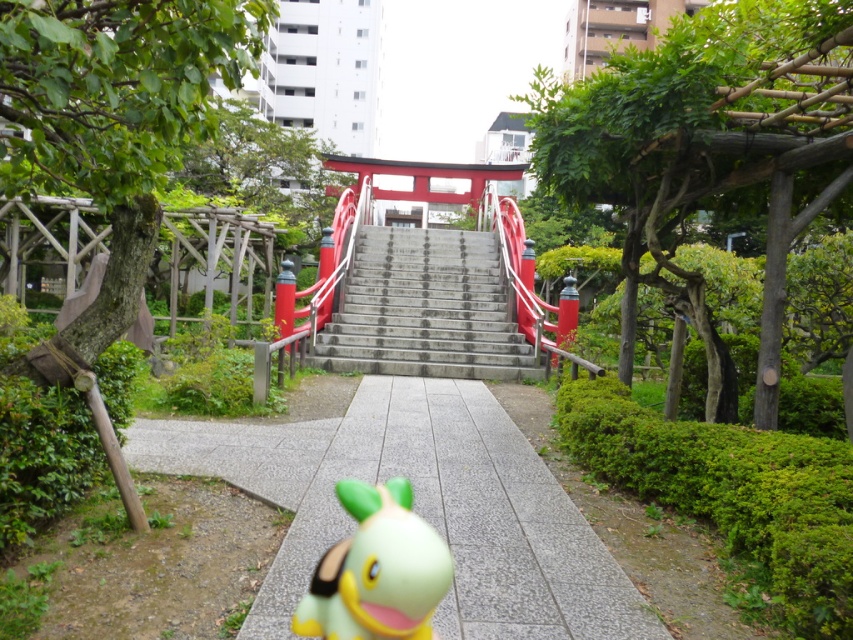
Does smooth concrete path at center have a smaller size compared to smooth concrete stairs at center?

Yes, smooth concrete path at center is smaller than smooth concrete stairs at center.

Can you confirm if smooth concrete path at center is taller than smooth concrete stairs at center?

No, smooth concrete path at center is not taller than smooth concrete stairs at center.

Who is more distant from viewer, (624, 614) or (376, 371)?

Point (376, 371)

Locate an element on the screen. This screenshot has width=853, height=640. smooth concrete path at center is located at coordinates (418, 506).

What do you see at coordinates (418, 506) in the screenshot?
I see `smooth concrete path at center` at bounding box center [418, 506].

Can you confirm if smooth concrete path at center is wider than green rubber toy at center?

Yes, smooth concrete path at center is wider than green rubber toy at center.

Between point (276, 420) and point (334, 616), which one is positioned in front?

Point (334, 616) is in front.

You are a GUI agent. You are given a task and a screenshot of the screen. Output one action in this format:
    pyautogui.click(x=<x>, y=<y>)
    Task: Click on the smooth concrete path at center
    
    Given the screenshot: What is the action you would take?
    pyautogui.click(x=418, y=506)

Is smooth concrete stairs at center to the left of green rubber toy at center from the viewer's perspective?

In fact, smooth concrete stairs at center is to the right of green rubber toy at center.

Describe the element at coordinates (425, 308) in the screenshot. I see `smooth concrete stairs at center` at that location.

Find the location of a particular element. smooth concrete stairs at center is located at coordinates (425, 308).

Where is `smooth concrete stairs at center`? smooth concrete stairs at center is located at coordinates (425, 308).